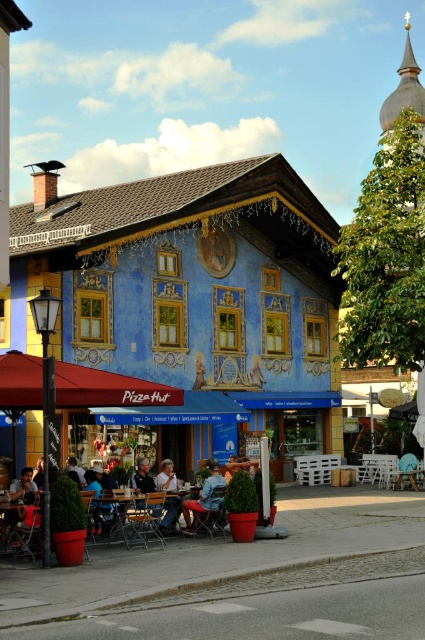
Between denim jacket at lower center and dark blue shirt at center, which one has less height?

Standing shorter between the two is dark blue shirt at center.

Does denim jacket at lower center have a greater height compared to dark blue shirt at center?

Yes.

Does point (217, 497) come in front of point (133, 486)?

Yes, it is in front of point (133, 486).

This screenshot has height=640, width=425. I want to click on denim jacket at lower center, so click(204, 499).

Can you confirm if blue painted building at center is thinner than red fabric umbrella at lower left?

In fact, blue painted building at center might be wider than red fabric umbrella at lower left.

Consider the image. Measure the distance between blue painted building at center and red fabric umbrella at lower left.

blue painted building at center is 17.27 meters from red fabric umbrella at lower left.

Which is in front, point (42, 188) or point (142, 397)?

Positioned in front is point (142, 397).

This screenshot has height=640, width=425. Identify the location of blue painted building at center. (192, 296).

The height and width of the screenshot is (640, 425). Describe the element at coordinates (107, 388) in the screenshot. I see `red fabric umbrella at lower left` at that location.

Is point (155, 396) less distant than point (138, 474)?

Yes, it is in front of point (138, 474).

Who is more forward, (173, 403) or (139, 480)?

Point (173, 403) is more forward.

Where is `red fabric umbrella at lower left`? Image resolution: width=425 pixels, height=640 pixels. red fabric umbrella at lower left is located at coordinates (107, 388).